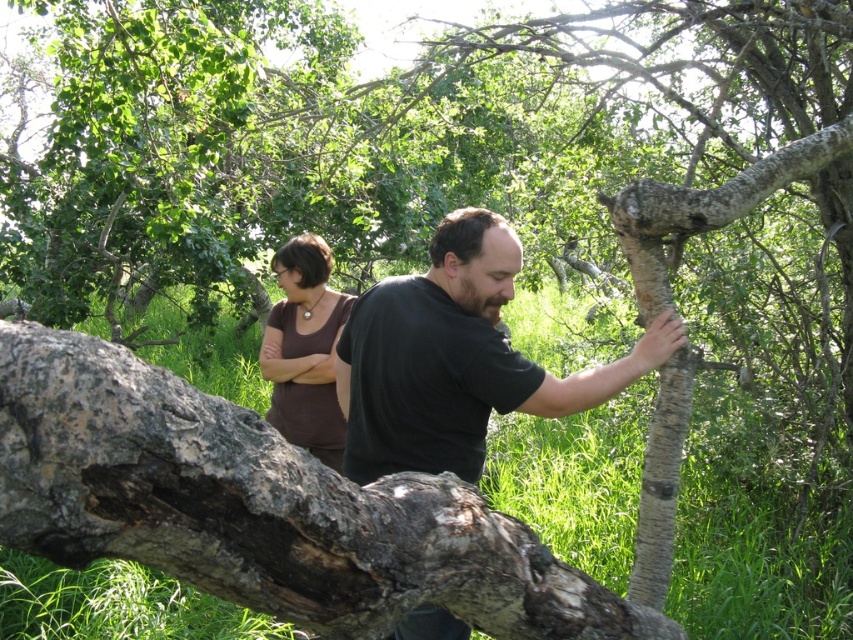
Question: Can you confirm if rough bark tree trunk at right is positioned to the left of brown matte shirt at center?

Choices:
 (A) yes
 (B) no

Answer: (B)

Question: Which object is farther from the camera taking this photo?

Choices:
 (A) smooth bark tree branch at upper right
 (B) dark brown wood tree trunk at center
 (C) brown matte shirt at center

Answer: (C)

Question: Does rough bark log at center have a lesser width compared to brown matte shirt at center?

Choices:
 (A) no
 (B) yes

Answer: (A)

Question: Which of the following is the closest to the observer?

Choices:
 (A) brown matte shirt at center
 (B) dark brown wood tree trunk at center

Answer: (B)

Question: Considering the real-world distances, which object is farthest from the brown matte shirt at center?

Choices:
 (A) rough bark tree trunk at right
 (B) smooth bark tree branch at upper right
 (C) rough bark log at center

Answer: (C)

Question: Does rough bark log at center have a smaller size compared to dark brown wood tree trunk at center?

Choices:
 (A) no
 (B) yes

Answer: (B)